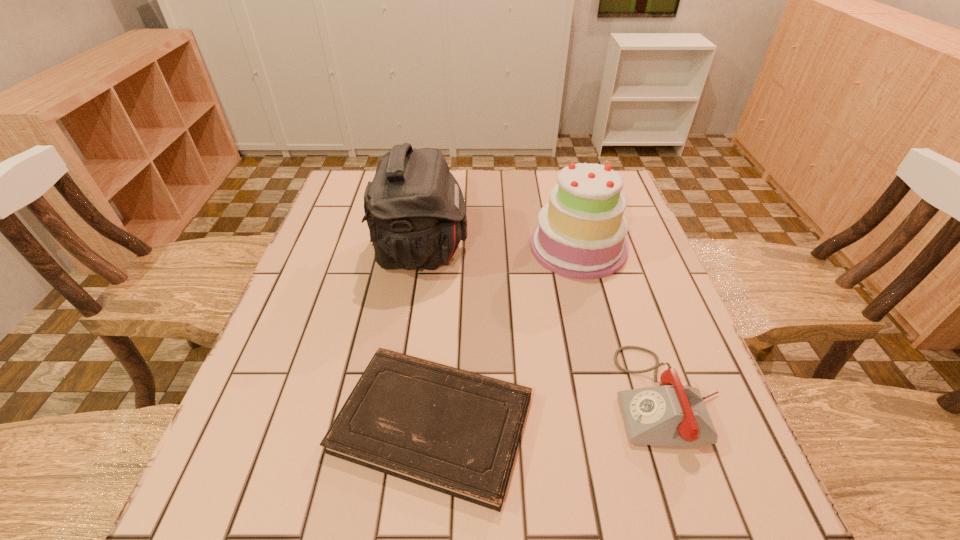
In order to click on object present at the near edge in this screenshot , I will do `click(453, 431)`.

Where is `cake present at the right edge`? This screenshot has width=960, height=540. cake present at the right edge is located at coordinates (581, 233).

At what (x,y) coordinates should I click in order to perform the action: click on telephone that is at the right edge. Please return your answer as a coordinate pair (x, y). The width and height of the screenshot is (960, 540). Looking at the image, I should click on (672, 414).

Find the location of a particular element. This screenshot has height=540, width=960. vacant region at the far edge is located at coordinates (545, 171).

At what (x,y) coordinates should I click in order to perform the action: click on free space at the near edge of the desktop. Please return your answer as a coordinate pair (x, y). Looking at the image, I should click on (x=388, y=489).

In the image, there is a desktop. At what (x,y) coordinates should I click in order to perform the action: click on vacant space at the left edge. Please return your answer as a coordinate pair (x, y). Looking at the image, I should click on (261, 418).

The width and height of the screenshot is (960, 540). I want to click on free space at the right edge, so click(631, 241).

Identify the location of vacant space at the far left corner of the desktop. The height and width of the screenshot is (540, 960). (352, 173).

The height and width of the screenshot is (540, 960). I want to click on free point between the shoulder bag and the cake, so click(499, 249).

Where is `free spot between the telephone and the tallest object`? The image size is (960, 540). free spot between the telephone and the tallest object is located at coordinates (544, 323).